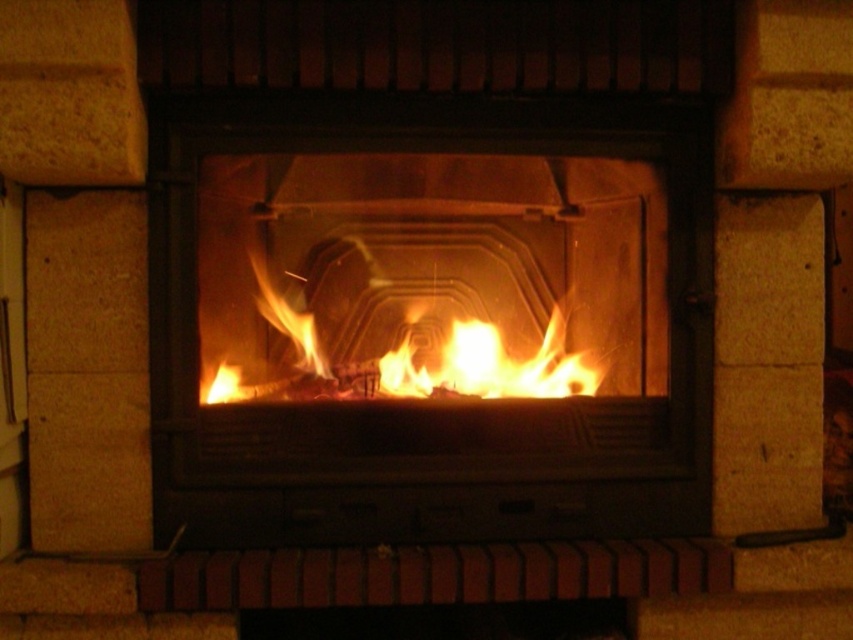
You are designing a safety barrier around the fireplace. The barrier must be placed between the matte black fireplace at center and the flametransparentfire at center. Which object should the barrier be closer to to ensure it doesn

The barrier should be placed closer to the flametransparentfire at center because the matte black fireplace at center might be wider than the flametransparentfire at center, so the flame might extend beyond the fireplace

You are standing in the living room and want to place a 1.5 meter wide painting above the matte black fireplace at center. Is the fireplace wide enough to accommodate the painting?

The matte black fireplace at center is 2.00 meters wide, so the 1.5 meter wide painting will fit comfortably above it.

You are an interior designer assessing the fireplace setup. The matte black fireplace at center and the flametransparentfire at center are both part of the design. Based on their sizes, which one do you think occupies more vertical space in the room?

The matte black fireplace at center is much taller than the flametransparentfire at center, so it occupies more vertical space in the room.